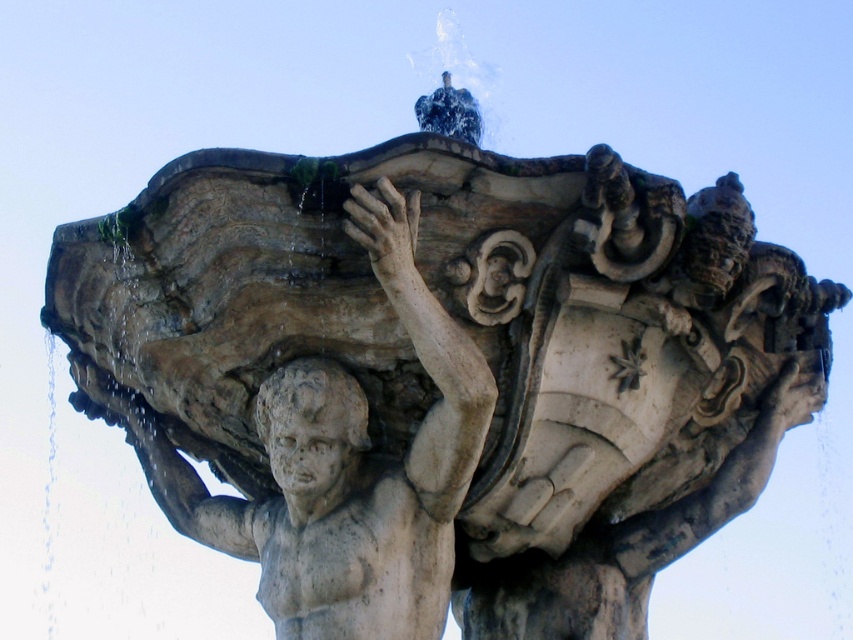
Is white stone cherub at center thinner than stone head at center?

Incorrect, white stone cherub at center's width is not less than stone head at center's.

Measure the distance between white stone cherub at center and camera.

50.01 meters

Where is `white stone cherub at center`? The width and height of the screenshot is (853, 640). white stone cherub at center is located at coordinates (341, 465).

Where is `white stone cherub at center`? white stone cherub at center is located at coordinates (341, 465).